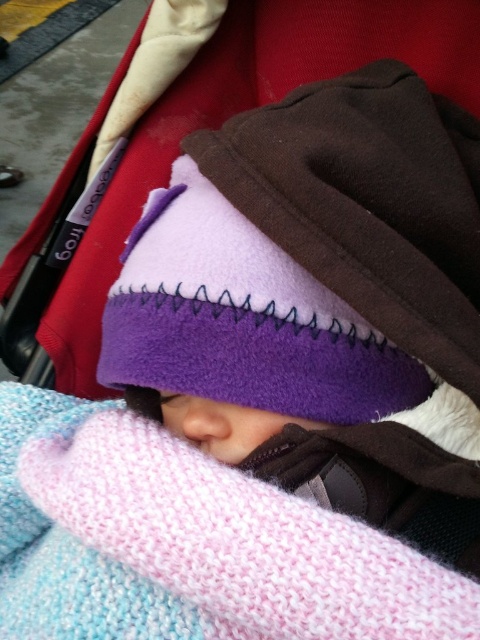
In the scene shown: Does purple fleece hat at center have a greater height compared to pink knitted blanket at center?

Yes, purple fleece hat at center is taller than pink knitted blanket at center.

Is point (332, 292) behind point (205, 605)?

Yes, point (332, 292) is behind point (205, 605).

Is point (215, 337) less distant than point (126, 589)?

No, (215, 337) is behind (126, 589).

Find the location of a particular element. purple fleece hat at center is located at coordinates (310, 257).